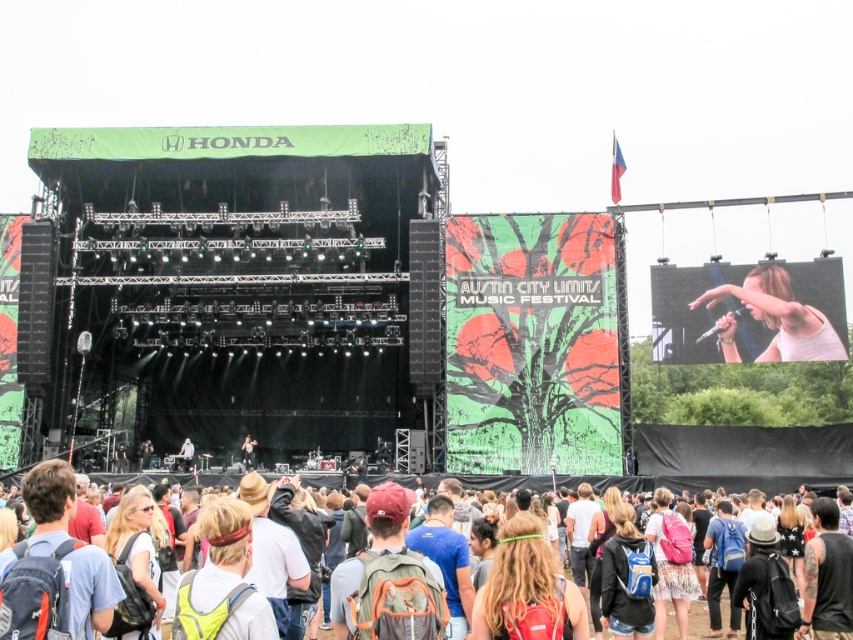
You are a photographer at the Austin City Limits Music Festival. You need to capture a photo that includes both the white matte shirt at upper right and the white cotton shirt at lower center. Which shirt should you adjust your camera angle to focus on first to ensure both are in frame?

The white matte shirt at upper right is shorter than the white cotton shirt at lower center, so you should focus on the white cotton shirt at lower center first to ensure both are in frame.

You are a photographer at the Austin City Limits Music Festival. You want to capture a photo that includes both the white matte shirt at upper right and the matte black jacket at center. Which object should you adjust your camera angle to focus on first to ensure both are in frame?

The white matte shirt at upper right is much taller than the matte black jacket at center, so you should focus on the white matte shirt at upper right first to ensure both are in frame.

You are a photographer at the Austin City Limits Music Festival. You want to capture a photo that includes both the white matte shirt at upper right and the matte black jacket at center. Based on their positions, which one will appear closer to the top of the photo?

The white matte shirt at upper right is positioned over the matte black jacket at center, so it will appear closer to the top of the photo.